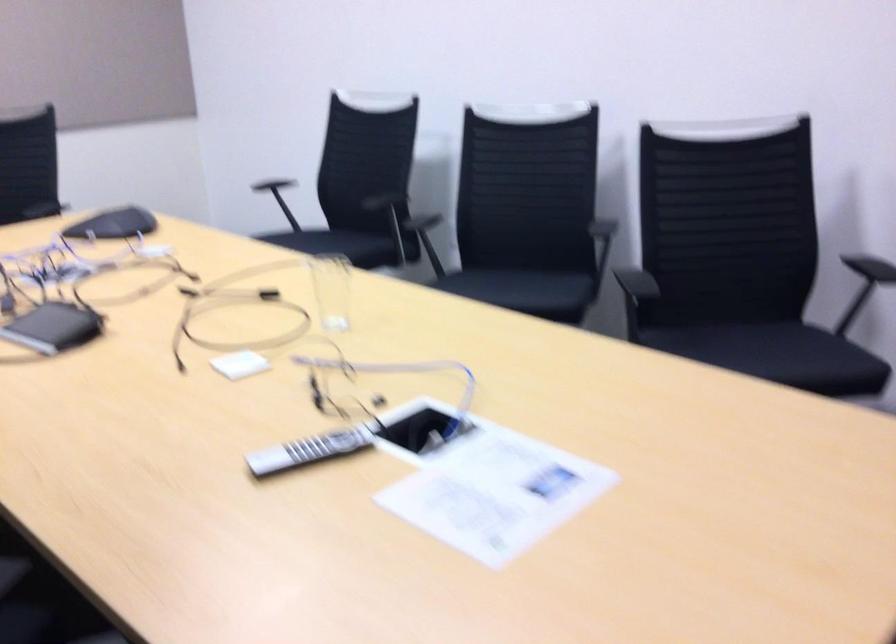
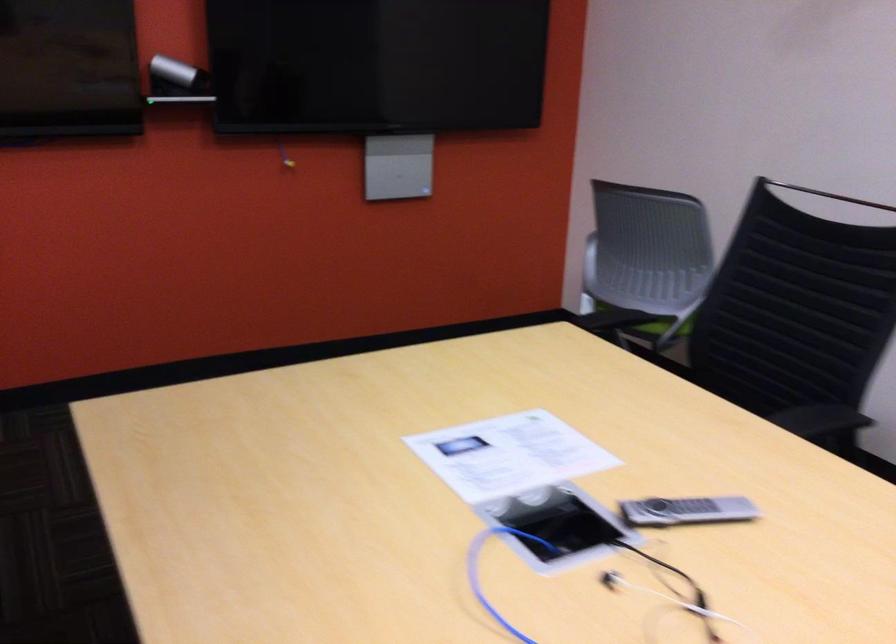
Find the pixel in the second image that matches (x=389, y=406) in the first image.

(576, 583)